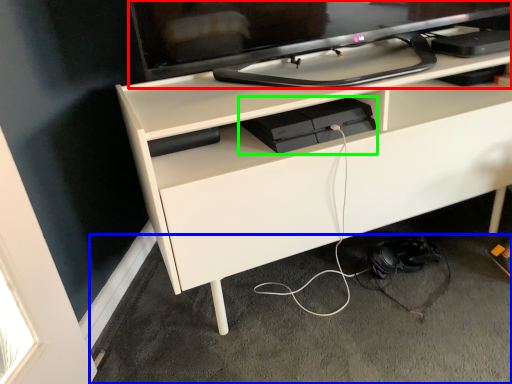
Question: Considering the real-world distances, which object is farthest from television (highlighted by a red box)? concrete (highlighted by a blue box) or equipment (highlighted by a green box)?

Choices:
 (A) concrete
 (B) equipment

Answer: (A)